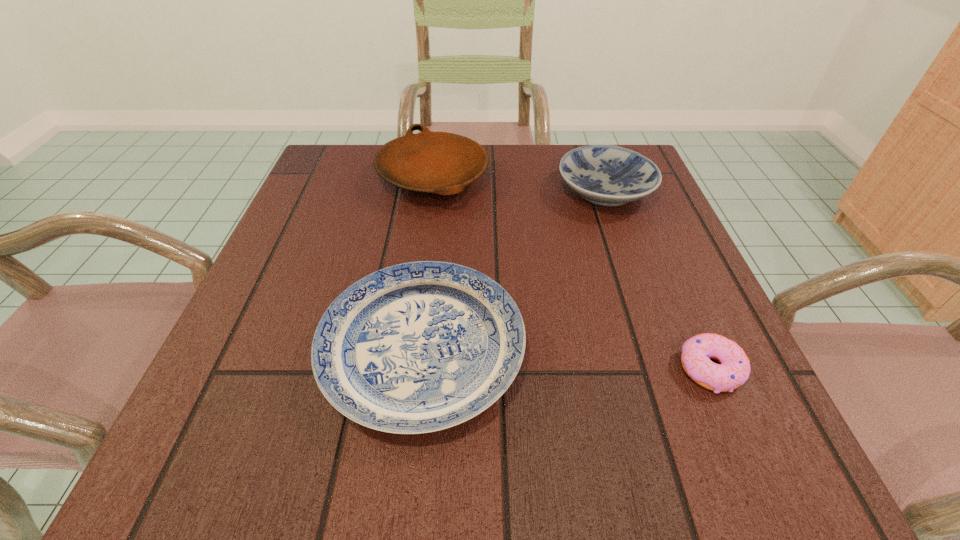
Find the location of a particular element. This screenshot has width=960, height=540. vacant area between the rightmost plate and the doughnut is located at coordinates (658, 280).

At what (x,y) coordinates should I click in order to perform the action: click on free spot between the shortest plate and the rightmost plate. Please return your answer as a coordinate pair (x, y). Looking at the image, I should click on (514, 271).

Identify the location of vacant region between the rightmost plate and the nearest plate. The width and height of the screenshot is (960, 540). (514, 271).

Locate which object is the closest to the doughnut. Please provide its 2D coordinates. Your answer should be formatted as a tuple, i.e. [(x, y)], where the tuple contains the x and y coordinates of a point satisfying the conditions above.

[(418, 347)]

Where is `object that is the closest one to the rightmost plate`? object that is the closest one to the rightmost plate is located at coordinates point(443,163).

This screenshot has width=960, height=540. Find the location of `plate that stands as the closest to the nearest plate`. plate that stands as the closest to the nearest plate is located at coordinates (443, 163).

Where is `the second closest plate to the rightmost plate`? The width and height of the screenshot is (960, 540). the second closest plate to the rightmost plate is located at coordinates (418, 347).

Where is `blank space that satisfies the following two spatial constraints: 1. on the front side of the nearest plate; 2. on the right side of the doughnut`? blank space that satisfies the following two spatial constraints: 1. on the front side of the nearest plate; 2. on the right side of the doughnut is located at coordinates (420, 368).